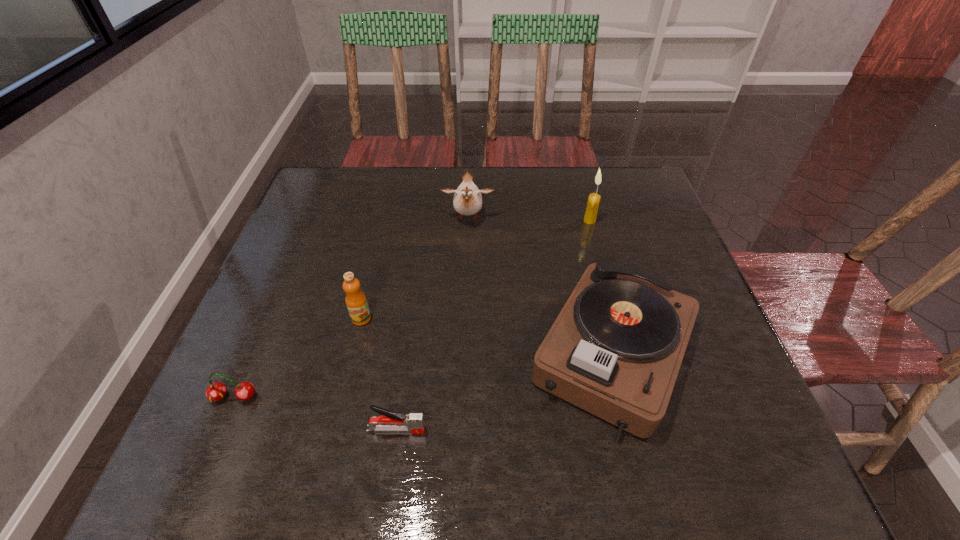
Find the location of a particular element. The width and height of the screenshot is (960, 540). free space at the left edge of the desktop is located at coordinates click(321, 319).

Find the location of `blank space at the right edge`. blank space at the right edge is located at coordinates (681, 400).

You are a GUI agent. You are given a task and a screenshot of the screen. Output one action in this format:
    pyautogui.click(x=<x>, y=<y>)
    Task: Click on the vacant space at the far left corner of the desktop
    The width and height of the screenshot is (960, 540).
    Given the screenshot: What is the action you would take?
    pyautogui.click(x=349, y=209)

You are a GUI agent. You are given a task and a screenshot of the screen. Output one action in this format:
    pyautogui.click(x=<x>, y=<y>)
    Task: Click on the free region at the far right corner
    The width and height of the screenshot is (960, 540).
    Given the screenshot: What is the action you would take?
    pyautogui.click(x=604, y=176)

I want to click on empty space that is in between the fourth tallest object and the cherry, so click(x=423, y=375).

Identify the location of vacant area that lies between the stapler and the bird. (432, 324).

The image size is (960, 540). In order to click on free spot between the tallest object and the stapler in this screenshot , I will do `click(492, 325)`.

What are the coordinates of `free point between the orange juice and the tallest object` in the screenshot? It's located at (475, 269).

The image size is (960, 540). What are the coordinates of `vacant space that's between the stapler and the bird` in the screenshot? It's located at (432, 324).

This screenshot has height=540, width=960. Identify the location of free space between the orange juice and the cherry. (298, 357).